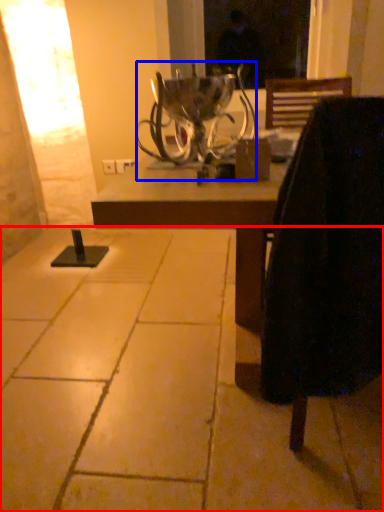
Question: Among these objects, which one is nearest to the camera, concrete (highlighted by a red box) or candle holder (highlighted by a blue box)?

Choices:
 (A) concrete
 (B) candle holder

Answer: (A)